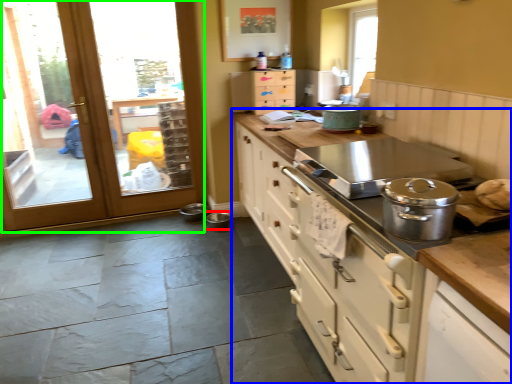
Question: Estimate the real-world distances between objects in this image. Which object is farther from appliance (highlighted by a red box), cabinetry (highlighted by a blue box) or door (highlighted by a green box)?

Choices:
 (A) cabinetry
 (B) door

Answer: (A)